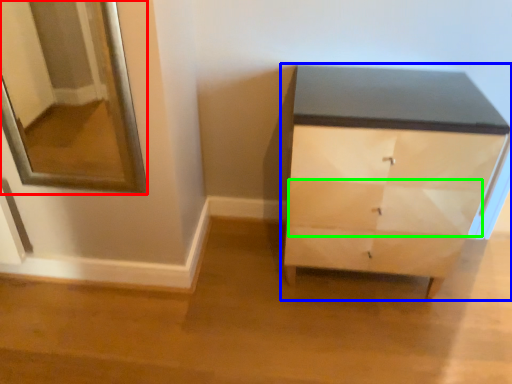
Question: Which object is the closest to the mirror (highlighted by a red box)? Choose among these: chest of drawers (highlighted by a blue box) or drawer (highlighted by a green box).

Choices:
 (A) chest of drawers
 (B) drawer

Answer: (A)